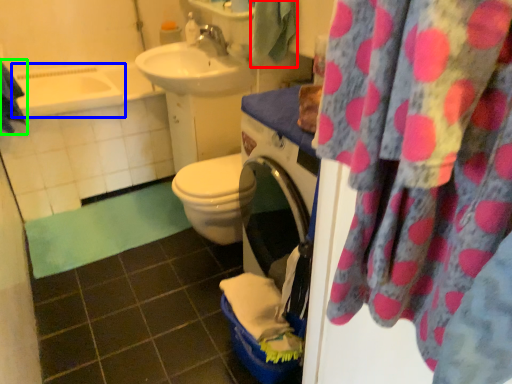
Question: Considering the real-world distances, which object is farthest from beach towel (highlighted by a red box)? bath (highlighted by a blue box) or beach towel (highlighted by a green box)?

Choices:
 (A) bath
 (B) beach towel

Answer: (A)